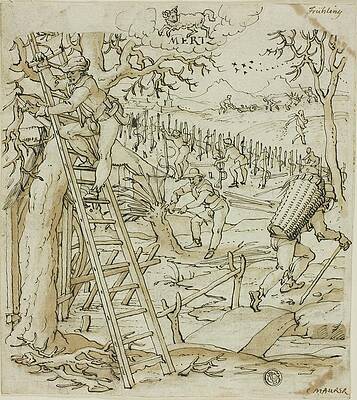
The height and width of the screenshot is (400, 357). In order to click on ladder in this screenshot , I will do `click(88, 234)`.